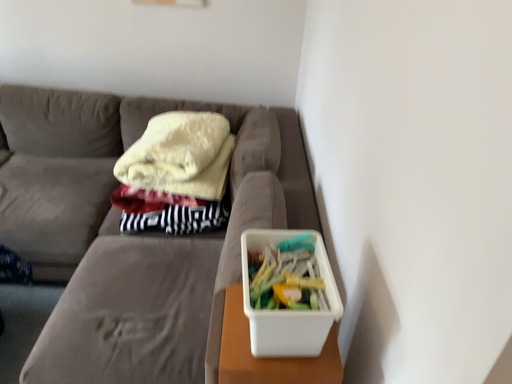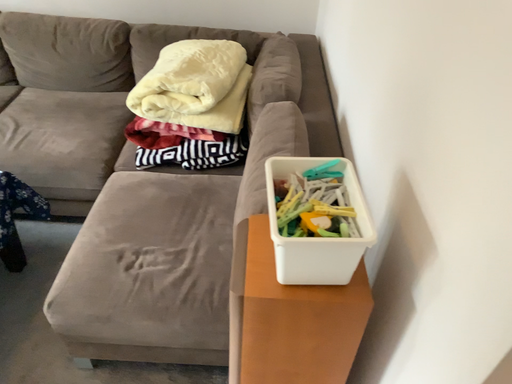
Question: Which way did the camera rotate in the video?

Choices:
 (A) rotated downward
 (B) rotated upward

Answer: (A)